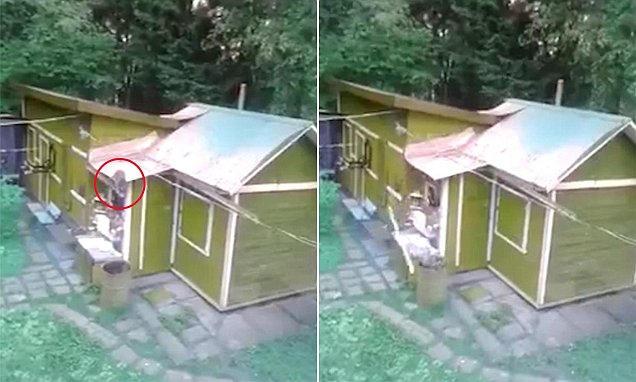
I want to click on pictures, so click(123, 159).